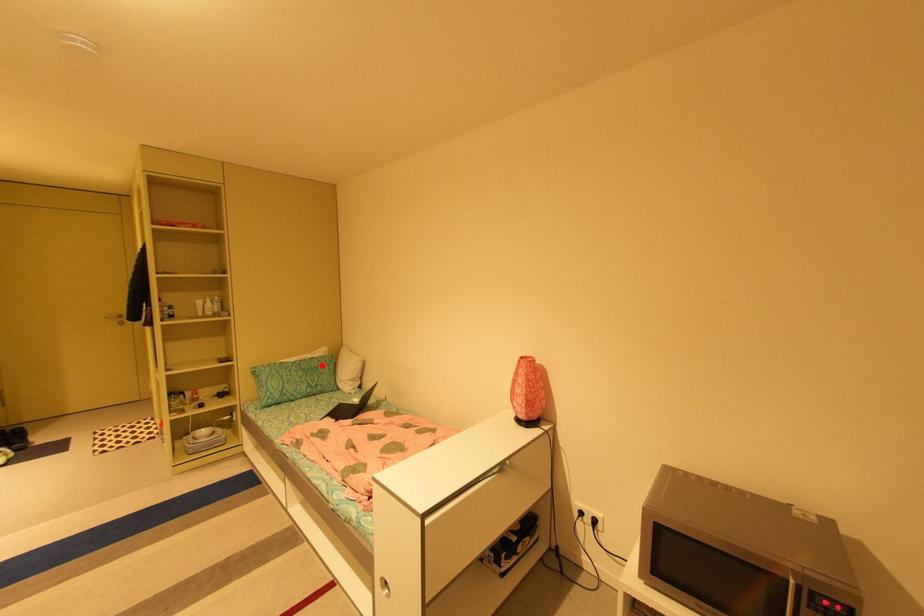
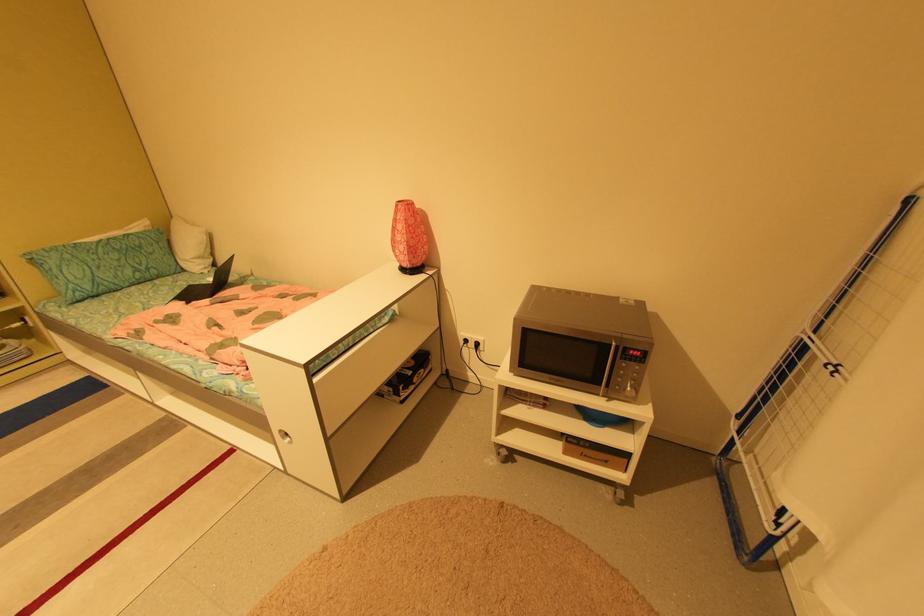
Question: I am providing you with two images of the same scene from different viewpoints. A red point is marked on the first image. Can you still see the location of the red point in image 2?

Choices:
 (A) Yes
 (B) No

Answer: (A)